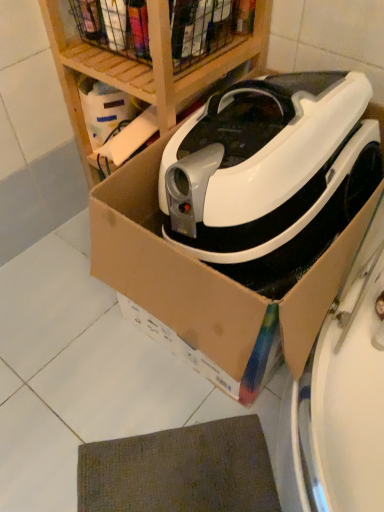
Locate an element on the screen. free region on the left part of brown textured mat at lower center is located at coordinates (50, 428).